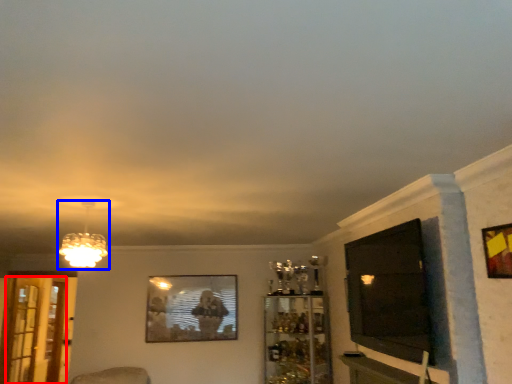
Question: Which object appears closest to the camera in this image, screen door (highlighted by a red box) or lamp (highlighted by a blue box)?

Choices:
 (A) screen door
 (B) lamp

Answer: (B)